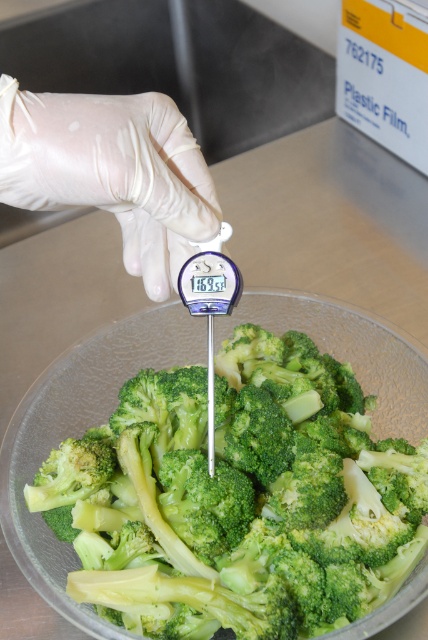
You are a quality inspector in a food processing plant. You need to check the temperature of the green matte broccoli at center using the white latex glove at upper left. Can you reach the broccoli with the glove without moving either object?

The green matte broccoli at center and white latex glove at upper left are 5.36 inches apart, so yes, the inspector can reach the broccoli with the glove without moving either object since the distance is manageable.

Consider the image. You are a quality inspector checking the broccoli in the bowl. There are two points marked on the broccoli florets at coordinates point (104, 612) and point (112, 132). Which point is closer to you?

Point (112, 132) is closer to you because point (104, 612) is behind it.

You are a quality inspector in a food processing plant. You need to check the temperature of the broccoli. The thermometer reads 16.9 degrees Fahrenheit. According to company policy, broccoli must be kept below 40 degrees Fahrenheit to ensure safety. Is the current temperature within the safe range? Additionally, which object is closer to you, the green matte broccoli at center or the white latex glove at upper left?

The current temperature of 16.9 degrees Fahrenheit is within the safe range as it is below 40 degrees Fahrenheit. The green matte broccoli at center is closer to you than the white latex glove at upper left.